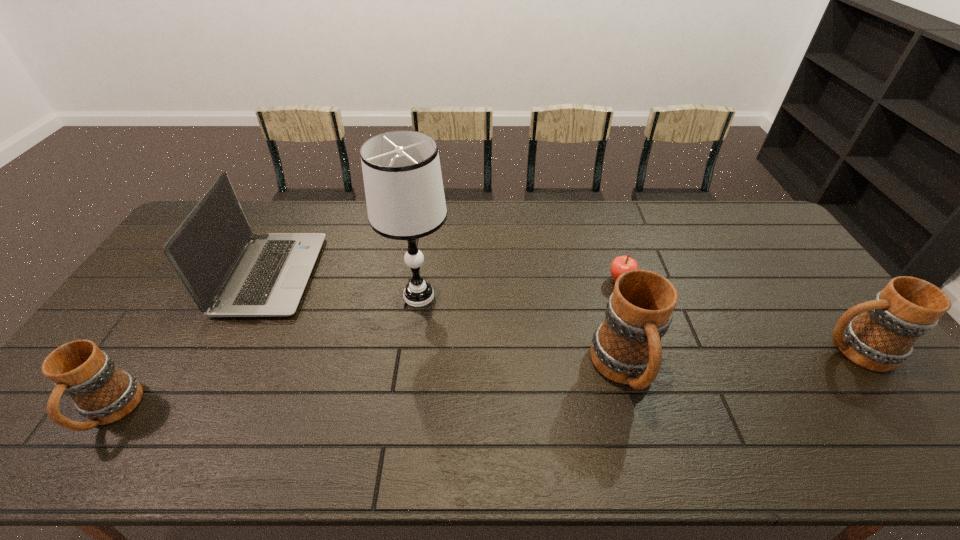
Where is `the shortest mug`? This screenshot has height=540, width=960. the shortest mug is located at coordinates (102, 393).

At what (x,y) coordinates should I click in order to perform the action: click on the leftmost mug. Please return your answer as a coordinate pair (x, y). The width and height of the screenshot is (960, 540). Looking at the image, I should click on (102, 393).

Locate an element on the screen. Image resolution: width=960 pixels, height=540 pixels. the second mug from right to left is located at coordinates (626, 348).

At what (x,y) coordinates should I click in order to perform the action: click on the rightmost object. Please return your answer as a coordinate pair (x, y). This screenshot has height=540, width=960. Looking at the image, I should click on (882, 337).

The image size is (960, 540). Identify the location of the fourth tallest object. (882, 337).

You are a GUI agent. You are given a task and a screenshot of the screen. Output one action in this format:
    pyautogui.click(x=<x>, y=<y>)
    Task: Click on the shortest object
    
    Given the screenshot: What is the action you would take?
    pyautogui.click(x=621, y=264)

This screenshot has width=960, height=540. What are the coordinates of `the third object from left to right` in the screenshot? It's located at click(404, 191).

Identify the location of table lamp. This screenshot has height=540, width=960. (404, 191).

At what (x,y) coordinates should I click in order to perform the action: click on laptop computer. Please return your answer as a coordinate pair (x, y). The height and width of the screenshot is (540, 960). Looking at the image, I should click on (230, 272).

The width and height of the screenshot is (960, 540). I want to click on vacant area located 0.210m on the side of the rightmost mug with the handle, so click(x=737, y=350).